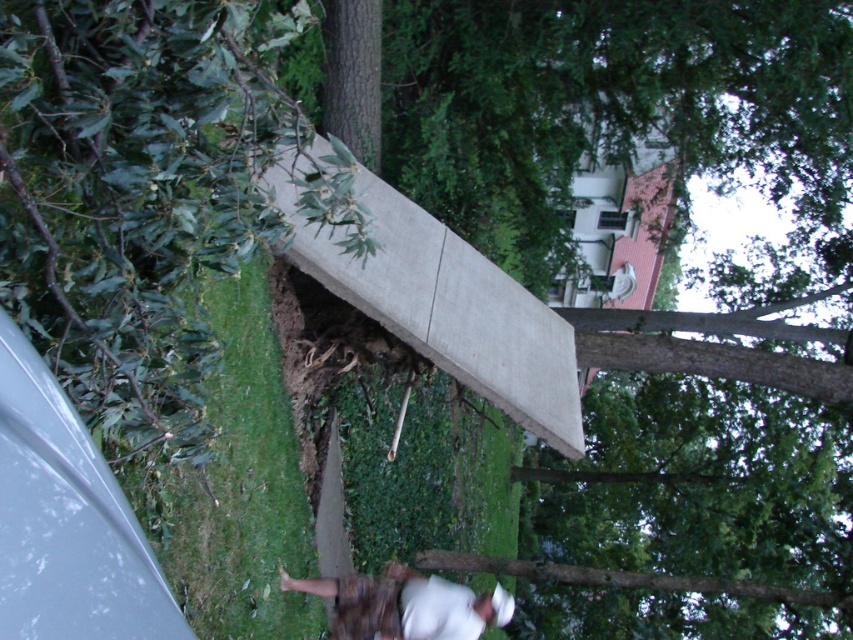
Question: Does green grass at lower left appear under white matte skateboard at lower center?

Choices:
 (A) yes
 (B) no

Answer: (B)

Question: From the image, what is the correct spatial relationship of green grass at lower left in relation to white matte skateboard at lower center?

Choices:
 (A) above
 (B) below

Answer: (A)

Question: Among these objects, which one is farthest from the camera?

Choices:
 (A) green grass at lower left
 (B) white matte skateboard at lower center

Answer: (B)

Question: Can you confirm if green grass at lower left is bigger than white matte skateboard at lower center?

Choices:
 (A) yes
 (B) no

Answer: (A)

Question: Which object is closer to the camera taking this photo?

Choices:
 (A) white matte skateboard at lower center
 (B) green grass at lower left

Answer: (B)